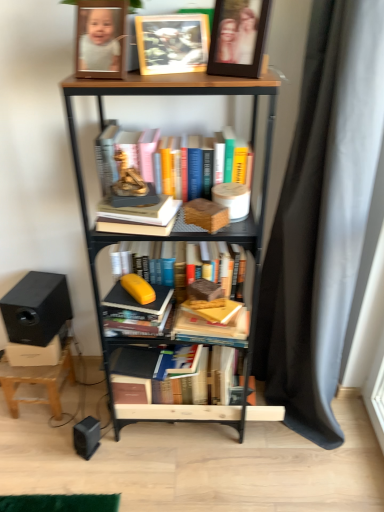
Image resolution: width=384 pixels, height=512 pixels. Find the location of `free space above hardcover book at center, the 3th book ordered from the bottom (from a real-world perspective)`. free space above hardcover book at center, the 3th book ordered from the bottom (from a real-world perspective) is located at coordinates (140, 198).